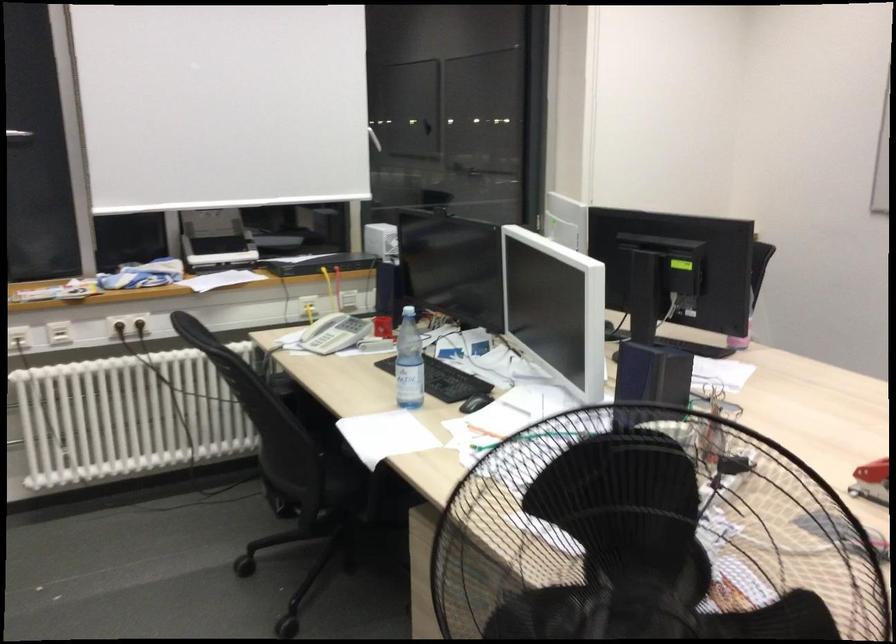
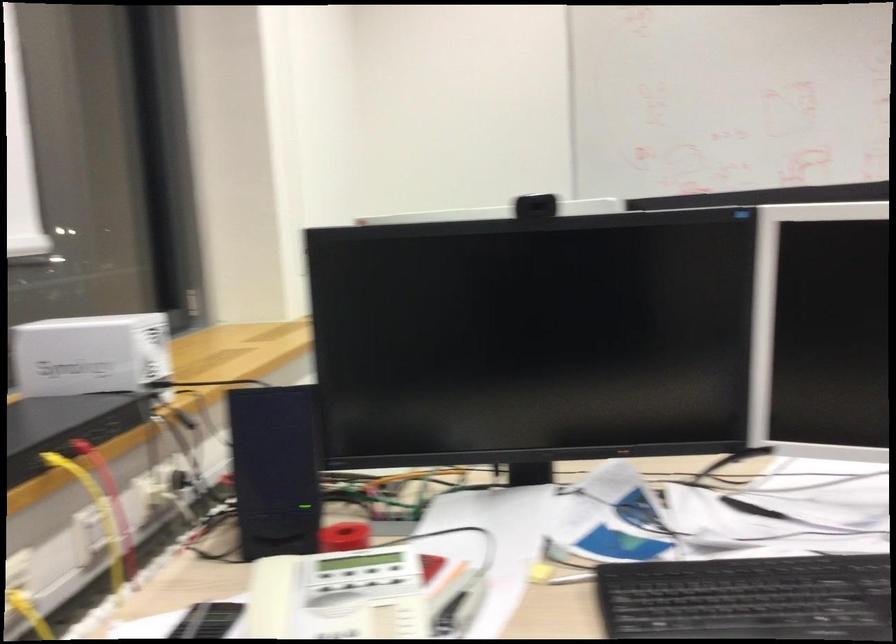
Find the pixel in the second image that matches (380,286) in the first image.

(274, 469)